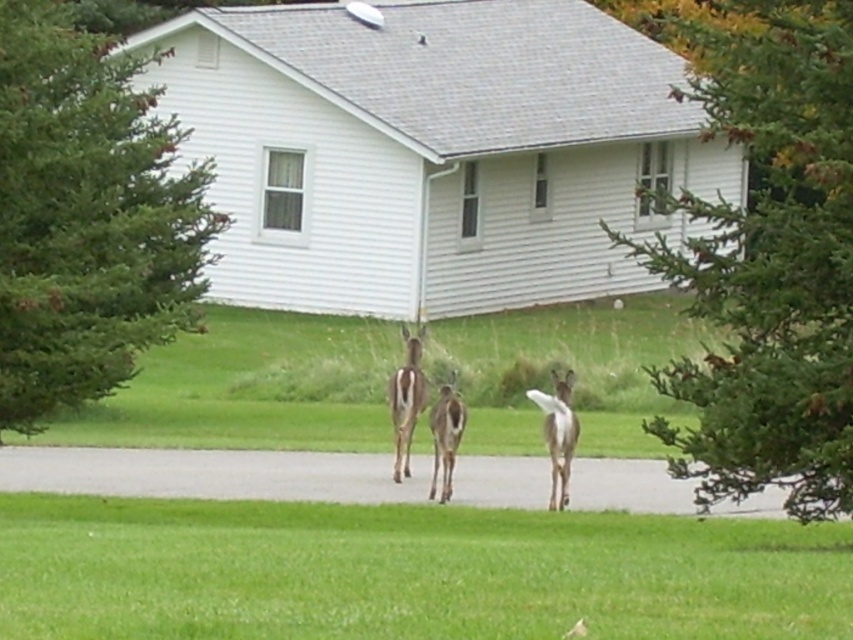
Which is in front, point (426, 524) or point (556, 416)?

Point (426, 524) is more forward.

The width and height of the screenshot is (853, 640). I want to click on green grass at lower center, so click(408, 572).

Between point (618, 563) and point (463, 412), which one is positioned in front?

Point (618, 563)

Is point (103, 582) positioned in front of point (445, 413)?

Yes, it is in front of point (445, 413).

Image resolution: width=853 pixels, height=640 pixels. What do you see at coordinates (408, 572) in the screenshot? I see `green grass at lower center` at bounding box center [408, 572].

Locate an element on the screen. The width and height of the screenshot is (853, 640). green grass at lower center is located at coordinates (408, 572).

Does green grass at lower center appear on the right side of brown fur deer at center?

Indeed, green grass at lower center is positioned on the right side of brown fur deer at center.

In the scene shown: Who is positioned more to the left, green grass at lower center or brown fur deer at center?

brown fur deer at center

Between point (21, 589) and point (398, 404), which one is positioned behind?

Point (398, 404)

Where is `green grass at lower center`? The image size is (853, 640). green grass at lower center is located at coordinates (408, 572).